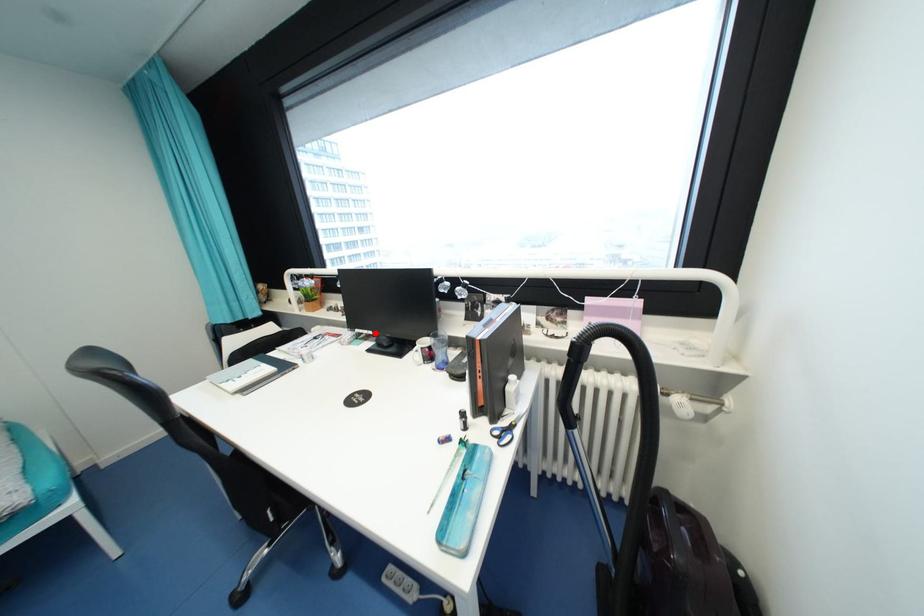
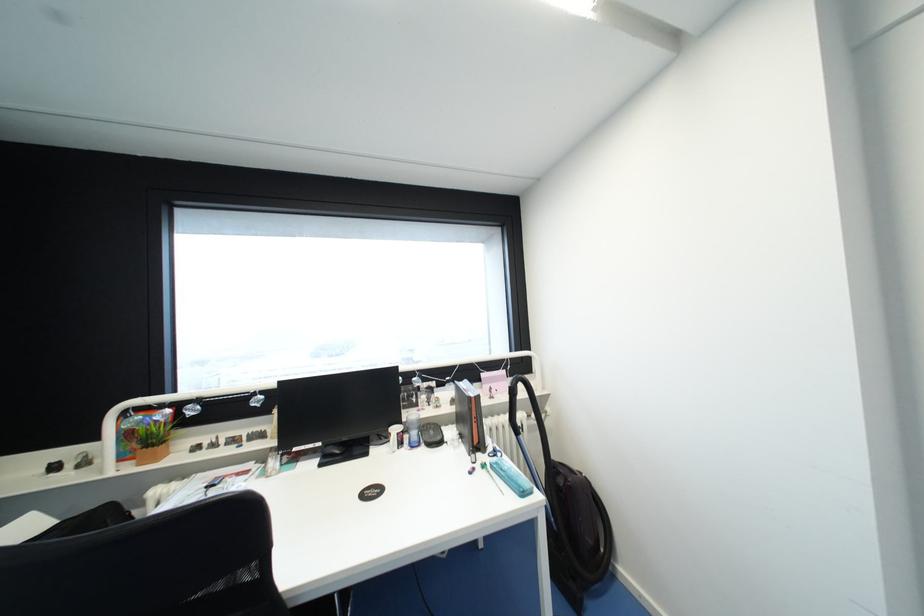
Question: I am providing you with two images of the same scene from different viewpoints. Given a red point in image1, look at the same physical point in image2. Is it:

Choices:
 (A) Closer to the viewpoint
 (B) Farther from the viewpoint

Answer: (B)